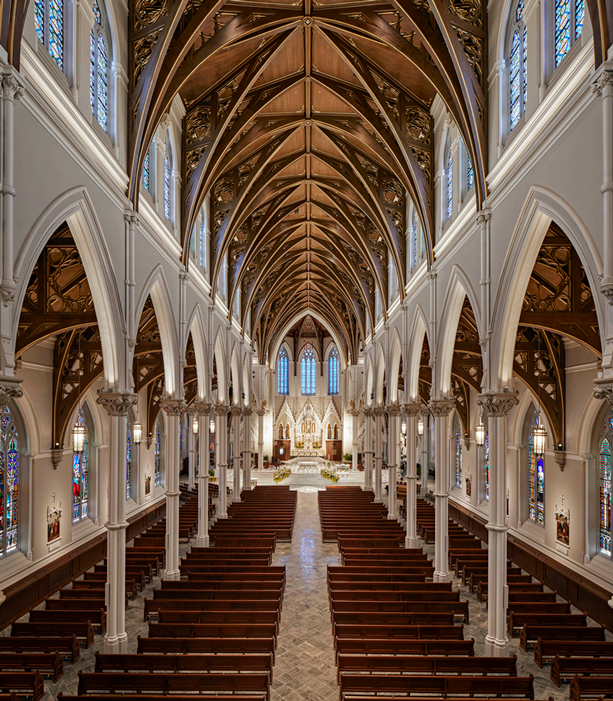
Locate an element on the screen. The height and width of the screenshot is (701, 613). holders is located at coordinates (78, 362).